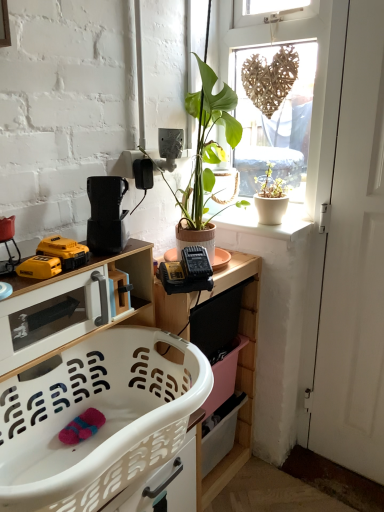
Question: Should I look upward or downward to see wooden shelf at center?

Choices:
 (A) down
 (B) up

Answer: (A)

Question: Does yellow plastic drill at lower left, the second toy viewed from the back, lie in front of yellow plastic drill at lower left, placed as the 2th toy when sorted from front to back?

Choices:
 (A) no
 (B) yes

Answer: (B)

Question: Is yellow plastic drill at lower left, the 1th toy from the front, completely or partially outside of yellow plastic drill at lower left, placed as the 1th toy when sorted from back to front?

Choices:
 (A) no
 (B) yes

Answer: (B)

Question: Is yellow plastic drill at lower left, the 1th toy from the front, looking in the opposite direction of yellow plastic drill at lower left, placed as the 2th toy when sorted from front to back?

Choices:
 (A) yes
 (B) no

Answer: (B)

Question: Considering the relative positions of yellow plastic drill at lower left, the second toy viewed from the back, and yellow plastic drill at lower left, placed as the 2th toy when sorted from front to back, in the image provided, is yellow plastic drill at lower left, the second toy viewed from the back, to the left of yellow plastic drill at lower left, placed as the 2th toy when sorted from front to back, from the viewer's perspective?

Choices:
 (A) no
 (B) yes

Answer: (B)

Question: From a real-world perspective, does yellow plastic drill at lower left, the second toy viewed from the back, sit lower than yellow plastic drill at lower left, placed as the 2th toy when sorted from front to back?

Choices:
 (A) no
 (B) yes

Answer: (B)

Question: Does yellow plastic drill at lower left, the second toy viewed from the back, contain yellow plastic drill at lower left, placed as the 1th toy when sorted from back to front?

Choices:
 (A) yes
 (B) no

Answer: (B)

Question: Is yellow plastic drill at lower left, the 1th toy from the front, next to wooden shelf at center?

Choices:
 (A) no
 (B) yes

Answer: (A)

Question: Does yellow plastic drill at lower left, the second toy viewed from the back, have a lesser height compared to wooden shelf at center?

Choices:
 (A) yes
 (B) no

Answer: (A)

Question: Is yellow plastic drill at lower left, the second toy viewed from the back, positioned beyond the bounds of wooden shelf at center?

Choices:
 (A) no
 (B) yes

Answer: (B)

Question: Could you tell me if yellow plastic drill at lower left, the second toy viewed from the back, is facing wooden shelf at center?

Choices:
 (A) yes
 (B) no

Answer: (B)

Question: Can you confirm if yellow plastic drill at lower left, the second toy viewed from the back, is wider than wooden shelf at center?

Choices:
 (A) yes
 (B) no

Answer: (B)

Question: From a real-world perspective, does yellow plastic drill at lower left, the 1th toy from the front, sit lower than wooden shelf at center?

Choices:
 (A) yes
 (B) no

Answer: (B)

Question: Is white plastic laundry basket at lower left, arranged as the second cabinetry when viewed from the top, surrounded by yellow plastic drill at lower left, placed as the 1th toy when sorted from back to front?

Choices:
 (A) yes
 (B) no

Answer: (B)